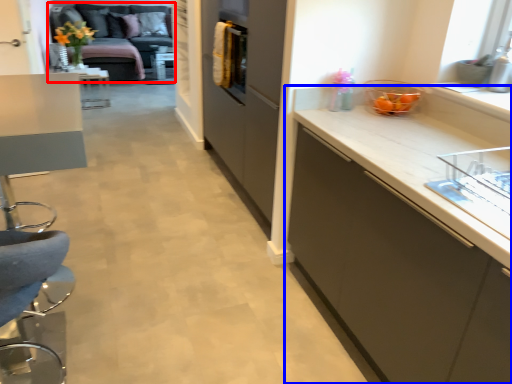
Question: Which object appears farthest to the camera in this image, studio couch (highlighted by a red box) or cabinetry (highlighted by a blue box)?

Choices:
 (A) studio couch
 (B) cabinetry

Answer: (A)